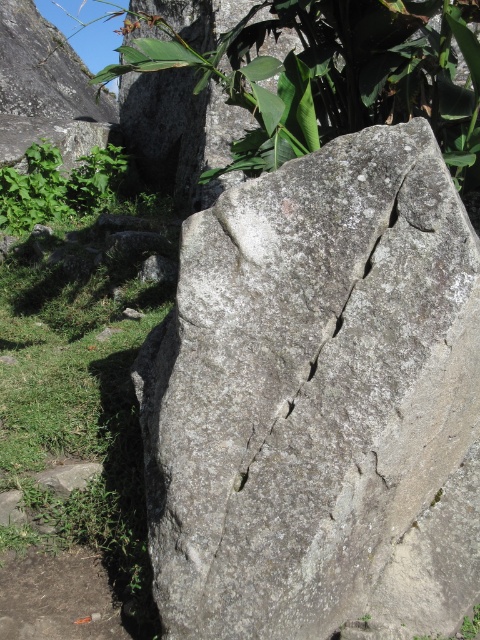
Question: Does gray rough rock at center lie in front of green leafy plant at center?

Choices:
 (A) yes
 (B) no

Answer: (A)

Question: Where is gray rough rock at center located in relation to green leafy plant at center in the image?

Choices:
 (A) below
 (B) above

Answer: (A)

Question: Which point is closer to the camera taking this photo?

Choices:
 (A) (247, 195)
 (B) (467, 180)

Answer: (A)

Question: Which point is farther to the camera?

Choices:
 (A) (407, 388)
 (B) (356, 24)

Answer: (B)

Question: Which point is closer to the camera?

Choices:
 (A) green leafy plant at center
 (B) gray rough rock at center

Answer: (B)

Question: Does gray rough rock at center appear on the right side of green leafy plant at center?

Choices:
 (A) yes
 (B) no

Answer: (B)